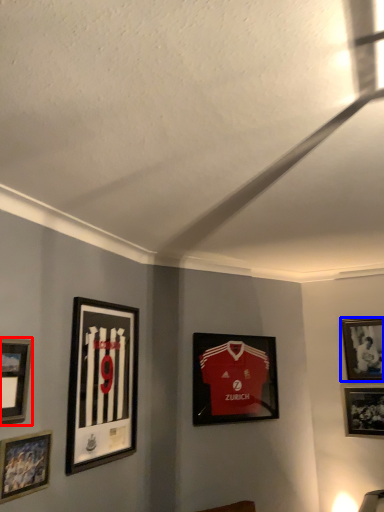
Question: Which of the following is the farthest to the observer, picture frame (highlighted by a red box) or picture frame (highlighted by a blue box)?

Choices:
 (A) picture frame
 (B) picture frame

Answer: (B)